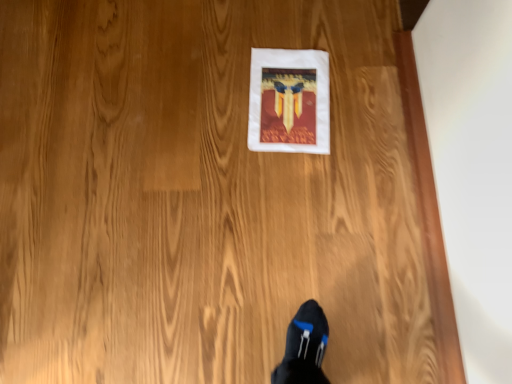
Find the location of `vacant space underneath matte paper comic book at center (from a real-world perspective)`. vacant space underneath matte paper comic book at center (from a real-world perspective) is located at coordinates (294, 99).